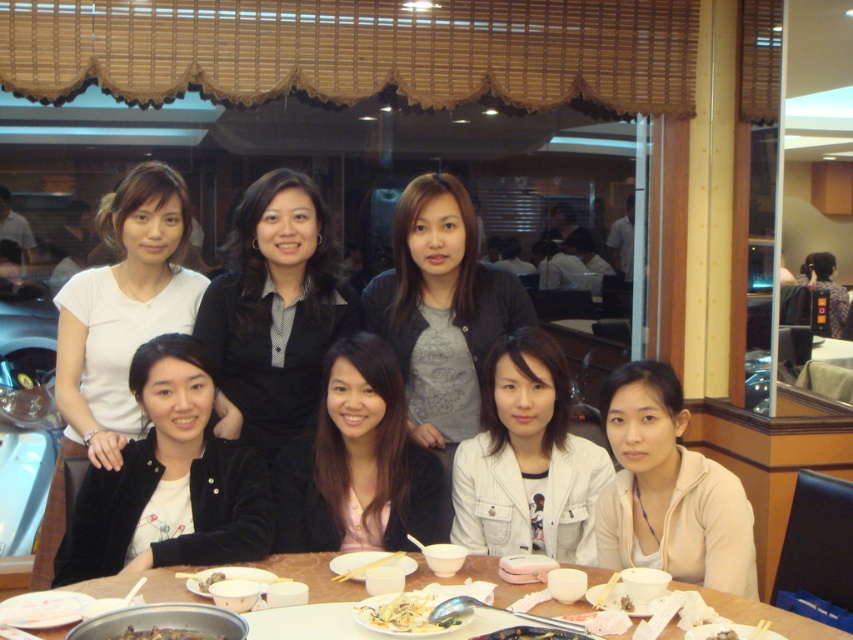
Is point (88, 490) behind point (190, 637)?

Yes, it is behind point (190, 637).

How far apart are velvet black jacket at lower left and brown glossy meat at center?

velvet black jacket at lower left is 28.71 inches away from brown glossy meat at center.

What do you see at coordinates (169, 481) in the screenshot? This screenshot has height=640, width=853. I see `velvet black jacket at lower left` at bounding box center [169, 481].

Locate an element on the screen. The image size is (853, 640). velvet black jacket at lower left is located at coordinates (169, 481).

Is velvet black jacket at lower left positioned behind wooden table at center?

Yes, it is behind wooden table at center.

Does velvet black jacket at lower left have a lesser width compared to wooden table at center?

Yes, velvet black jacket at lower left is thinner than wooden table at center.

What do you see at coordinates (169, 481) in the screenshot? I see `velvet black jacket at lower left` at bounding box center [169, 481].

This screenshot has width=853, height=640. I want to click on velvet black jacket at lower left, so click(x=169, y=481).

From the picture: Who is higher up, white matte shirt at upper left or white matte jacket at lower right?

Positioned higher is white matte shirt at upper left.

Between white matte shirt at upper left and white matte jacket at lower right, which one appears on the left side from the viewer's perspective?

white matte shirt at upper left is more to the left.

Which is behind, point (102, 272) or point (712, 576)?

The point (102, 272) is more distant.

This screenshot has height=640, width=853. In order to click on white matte shirt at upper left in this screenshot , I will do `click(123, 308)`.